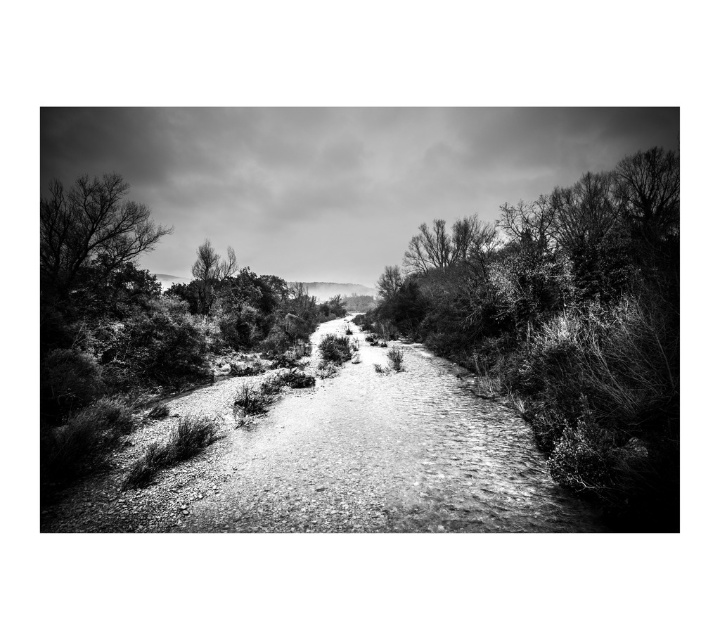
Question: Which of these objects is positioned farthest from the gravelly path at center?

Choices:
 (A) smooth bark tree at upper left
 (B) dirt/gravel path at center

Answer: (A)

Question: Is gravelly path at center to the left of smooth bark tree at upper left from the viewer's perspective?

Choices:
 (A) no
 (B) yes

Answer: (A)

Question: Which point is closer to the camera?

Choices:
 (A) gravelly path at center
 (B) dirt/gravel path at center

Answer: (A)

Question: Can you confirm if gravelly path at center is thinner than smooth bark tree at upper left?

Choices:
 (A) yes
 (B) no

Answer: (B)

Question: Which point is closer to the camera?

Choices:
 (A) dirt/gravel path at center
 (B) smooth bark tree at upper left

Answer: (A)

Question: Is dirt/gravel path at center in front of smooth bark tree at upper left?

Choices:
 (A) yes
 (B) no

Answer: (A)